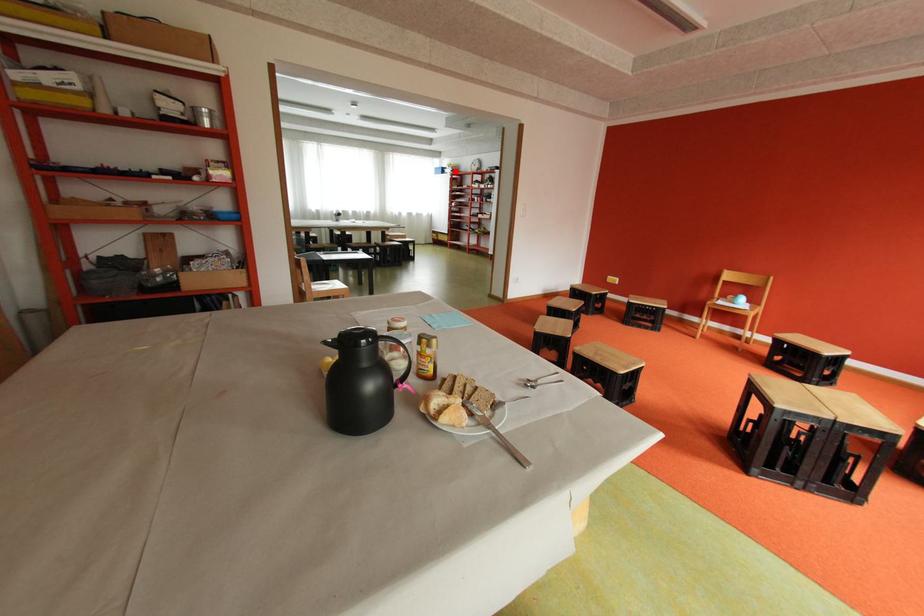
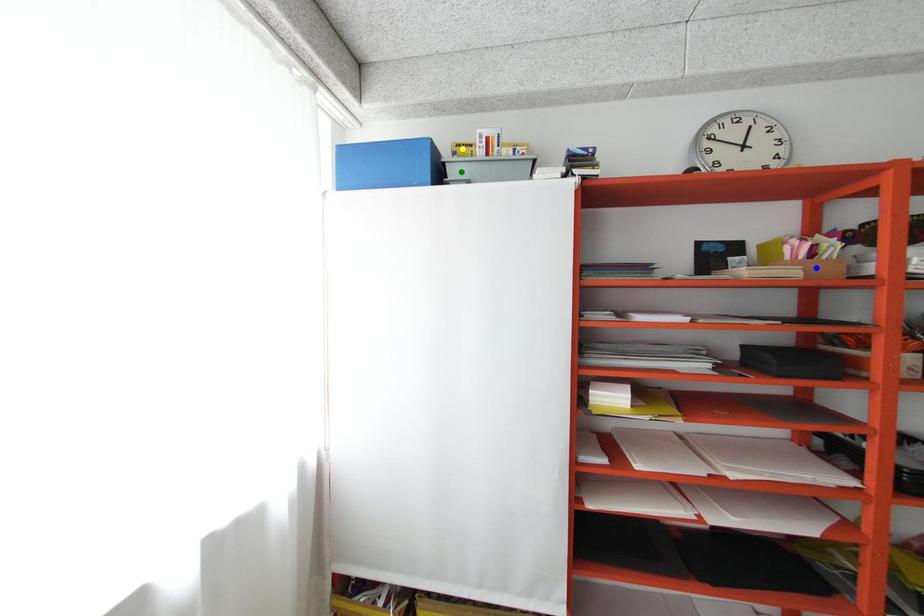
Question: I am providing you with two images of the same scene from different viewpoints. A red point is marked on the first image. You are given multiple points on the second image. Which mark in image 2 goes with the point in image 1?

Choices:
 (A) green point
 (B) blue point
 (C) yellow point

Answer: (A)